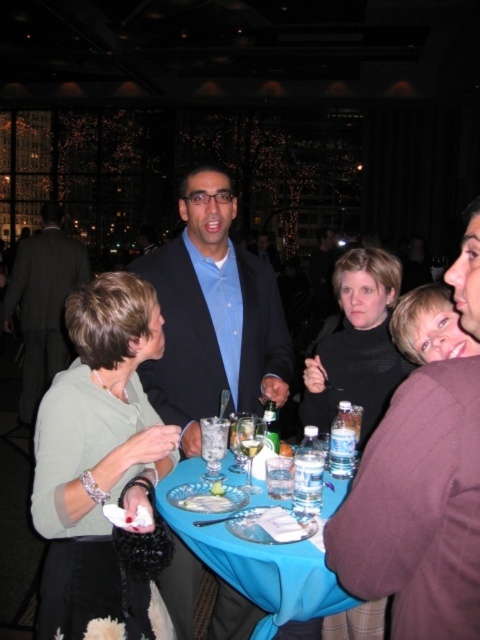
You are a guest at this event and want to grab a drink. Which item is positioned higher between the translucent plastic water at table center and the white porcelain plate at table center?

The translucent plastic water at table center is located above the white porcelain plate at table center.

You are a guest at the event and want to grab a drink. You see the clear plastic cup at table center. Where exactly is it located on the table?

The clear plastic cup at table center is located at point (x=279, y=481) on the table.

You are a server at the event and need to place a new beverage on the table. The beverage requires a space wider than the white porcelain plate at table center. Can you use the area where the translucent plastic water at table center is currently placed?

Yes, the translucent plastic water at table center has a width that surpasses the white porcelain plate at table center, so the area where it is placed can accommodate the beverage requiring more space than the plate.